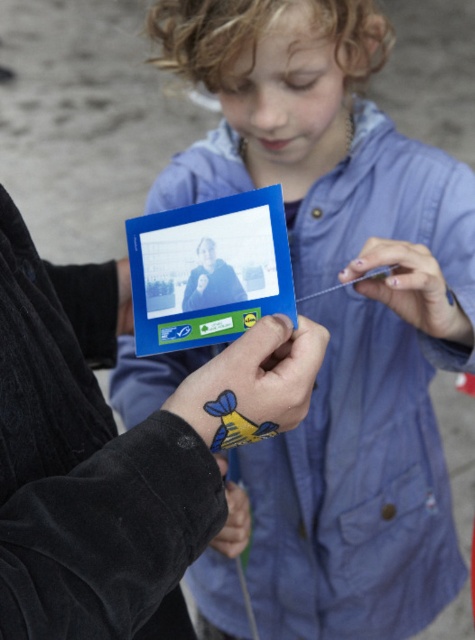
Which is below, blue tattooed hand at center or black matte hand at center?

black matte hand at center

Is point (229, 356) in front of point (245, 509)?

Yes, it is in front of point (245, 509).

This screenshot has width=475, height=640. I want to click on blue tattooed hand at center, so click(x=253, y=384).

Does blue plastic card at center have a lesser height compared to blue tattooed hand at center?

No.

Can you confirm if blue plastic card at center is positioned to the left of blue tattooed hand at center?

Indeed, blue plastic card at center is positioned on the left side of blue tattooed hand at center.

What do you see at coordinates (209, 269) in the screenshot? I see `blue plastic card at center` at bounding box center [209, 269].

Identify the location of blue plastic card at center. The height and width of the screenshot is (640, 475). (209, 269).

Is blue tattooed hand at center bigger than nail polish at center?

No, blue tattooed hand at center is not bigger than nail polish at center.

Is point (220, 428) farther from viewer compared to point (358, 269)?

No, it is not.

Where is `blue tattooed hand at center`? This screenshot has height=640, width=475. blue tattooed hand at center is located at coordinates (253, 384).